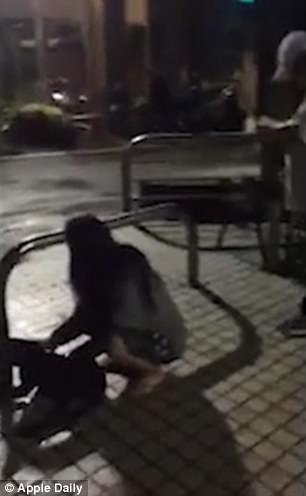
This screenshot has width=306, height=496. I want to click on tile ground, so click(261, 405), click(214, 327), click(32, 296).